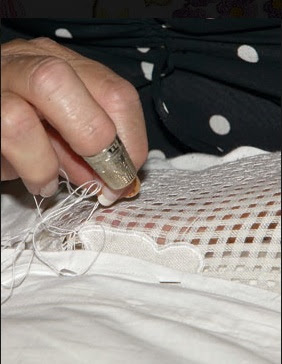
Identify the location of embroidery. (168, 247).